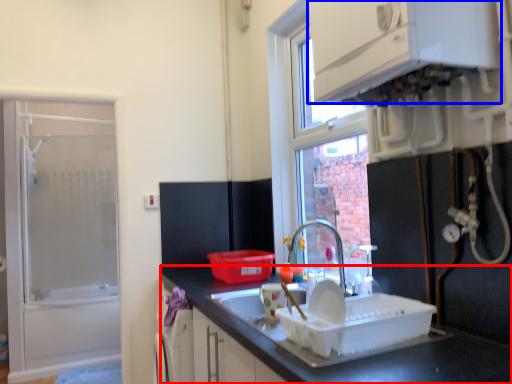
Question: Which object appears closest to the camera in this image, countertop (highlighted by a red box) or cabinetry (highlighted by a blue box)?

Choices:
 (A) countertop
 (B) cabinetry

Answer: (A)